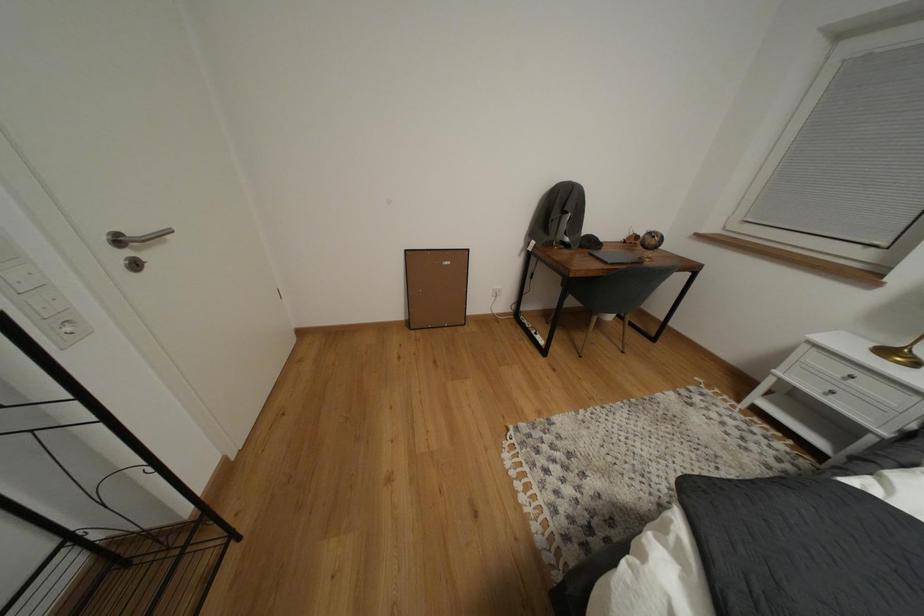
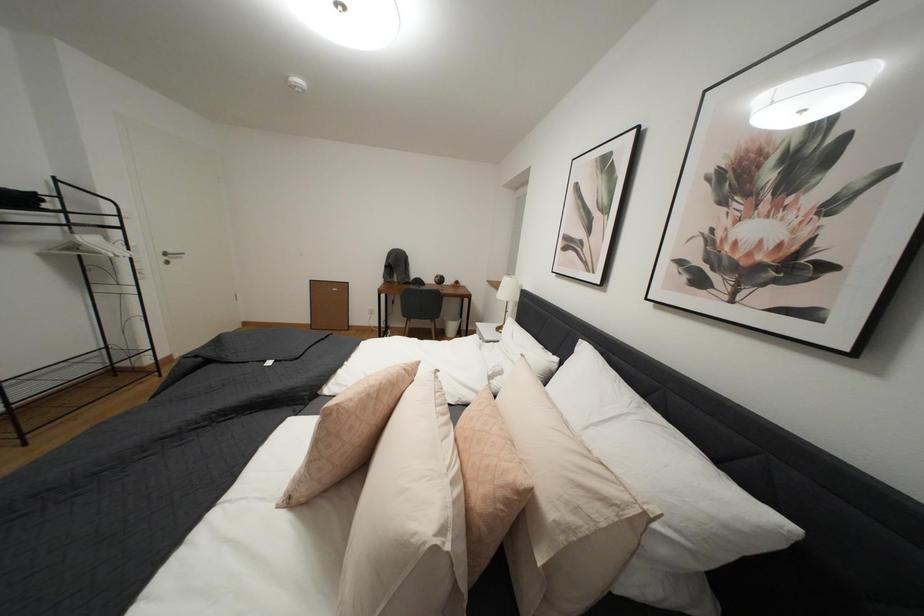
Consider the image. What movement of the cameraman would produce the second image?

The cameraman walked toward right, backward.